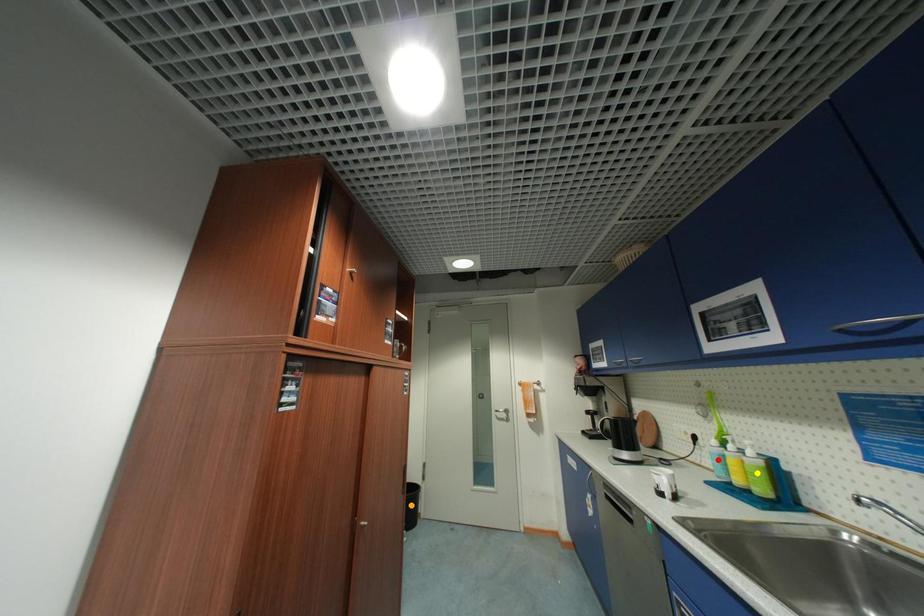
From the picture: Order these from farthest to nearest:
A) red point
B) yellow point
C) orange point

orange point < red point < yellow point